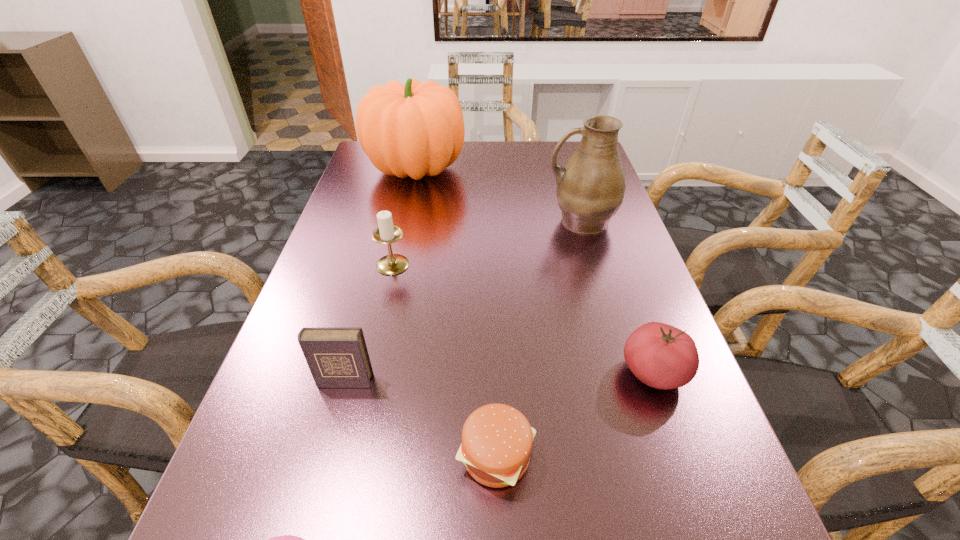
Find the location of a particular element. Image resolution: width=960 pixels, height=540 pixels. tomato that is positioned at the right edge is located at coordinates (661, 356).

At what (x,y) coordinates should I click in order to perform the action: click on object that is at the far left corner. Please return your answer as a coordinate pair (x, y). Image resolution: width=960 pixels, height=540 pixels. Looking at the image, I should click on (416, 129).

I want to click on vacant area at the far edge, so click(462, 171).

Locate an element on the screen. The width and height of the screenshot is (960, 540). free space at the right edge is located at coordinates (665, 485).

In the image, there is a desktop. Where is `vacant space at the far right corner`? vacant space at the far right corner is located at coordinates (550, 177).

The image size is (960, 540). Identify the location of empty space that is in between the hamburger and the diary. (420, 418).

In order to click on free space between the second nearest object and the fifth nearest object in this screenshot , I will do `click(444, 360)`.

Find the location of a particular element. This screenshot has width=960, height=540. unoccupied position between the sixth farthest object and the diary is located at coordinates (420, 418).

Identify the location of free spot between the tomato and the candle holder. (523, 319).

Image resolution: width=960 pixels, height=540 pixels. Find the location of `vacant space that's between the sixth nearest object and the second nearest object`. vacant space that's between the sixth nearest object and the second nearest object is located at coordinates (539, 338).